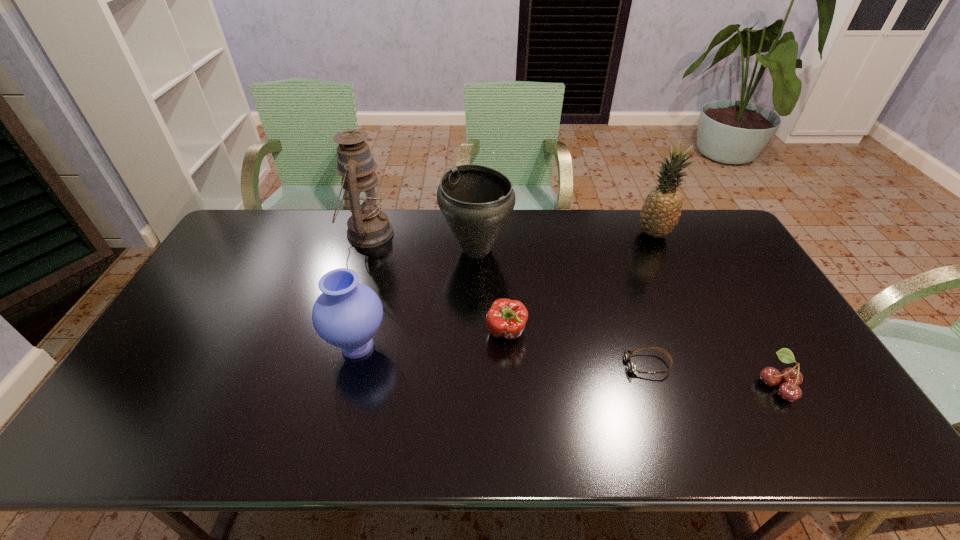
The width and height of the screenshot is (960, 540). Identify the location of vacant space situated 0.340m on the left of the sixth object from left to right. (540, 234).

Locate an element on the screen. The width and height of the screenshot is (960, 540). vacant space located on the front of the urn is located at coordinates (475, 369).

The height and width of the screenshot is (540, 960). What are the coordinates of `free point located 0.180m on the front of the vase` in the screenshot? It's located at (334, 438).

Where is `free space located on the left of the pepper`? This screenshot has width=960, height=540. free space located on the left of the pepper is located at coordinates (450, 333).

Where is `free region located on the leaves of the cherry`? free region located on the leaves of the cherry is located at coordinates (633, 384).

Where is `vacant space positioned 0.380m on the leaves of the cherry`? vacant space positioned 0.380m on the leaves of the cherry is located at coordinates [609, 384].

Where is `vacant space situated on the leaves of the cherry`? vacant space situated on the leaves of the cherry is located at coordinates pyautogui.click(x=664, y=384).

Where is `free location located 0.290m on the front-facing side of the third object from right to left`? free location located 0.290m on the front-facing side of the third object from right to left is located at coordinates (516, 365).

At what (x,y) coordinates should I click in order to perform the action: click on free spot located on the front-facing side of the third object from right to left. Please return your answer as a coordinate pair (x, y). This screenshot has height=540, width=960. Looking at the image, I should click on 568,365.

The height and width of the screenshot is (540, 960). Find the location of `free space located on the front-facing side of the third object from right to left`. free space located on the front-facing side of the third object from right to left is located at coordinates (531, 365).